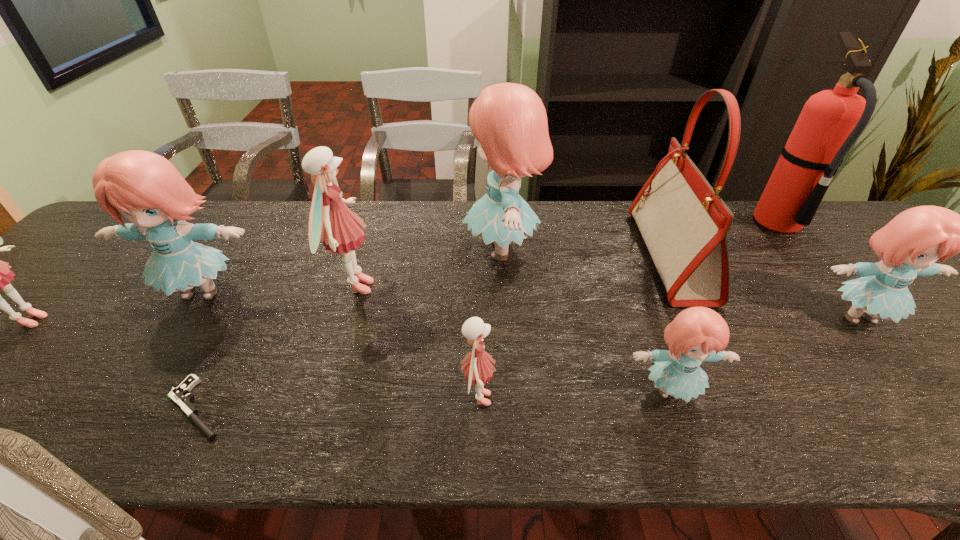
Find the location of `free space at the left edge`. free space at the left edge is located at coordinates (51, 333).

Identify the location of vacant space at the right edge. This screenshot has width=960, height=540. (860, 252).

Find the location of a particular element. The image size is (960, 540). free space at the far left corner is located at coordinates (124, 242).

This screenshot has height=540, width=960. Identify the location of empty space between the red fire extinguisher and the second pink doll from right to left. (566, 255).

The height and width of the screenshot is (540, 960). What are the coordinates of `free area in between the red fire extinguisher and the second doll from right to left` in the screenshot? It's located at (724, 307).

I want to click on free space between the third blue doll from right to left and the fire extinguisher, so 640,237.

The height and width of the screenshot is (540, 960). In order to click on empty space that is in between the rightmost pink doll and the tallest doll in this screenshot , I will do `click(491, 325)`.

The width and height of the screenshot is (960, 540). Identify the location of free space that is in between the black pistol and the smallest pink doll. (338, 403).

Where is `vacant area that lies between the handbag and the black pistol`? The width and height of the screenshot is (960, 540). vacant area that lies between the handbag and the black pistol is located at coordinates (434, 332).

Where is `object that is the seventh closest to the leftmost object`? This screenshot has height=540, width=960. object that is the seventh closest to the leftmost object is located at coordinates (684, 223).